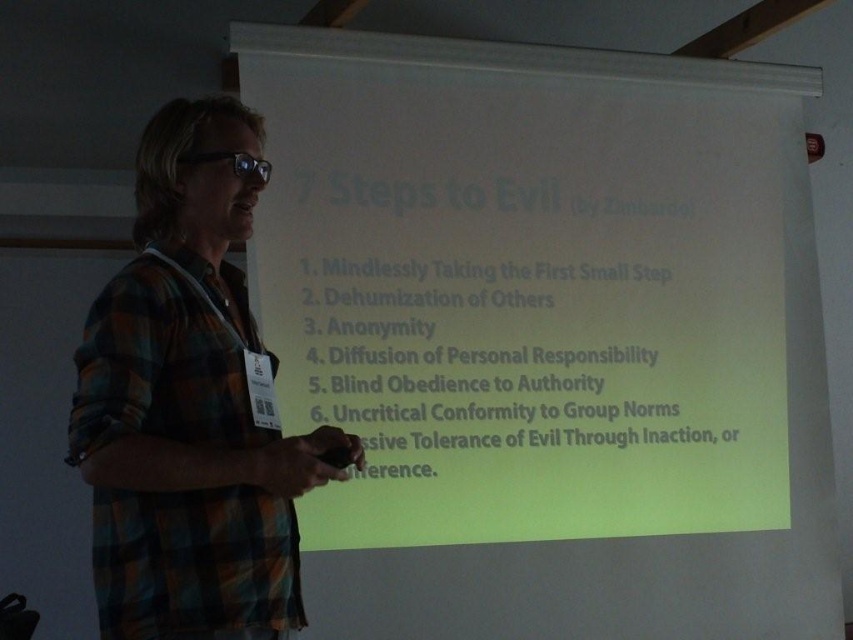
You are an event organizer setting up the presentation room. You need to ensure that the white matte projection screen at center is visible to all attendees. Considering the plaid fabric shirt at center is part of the presenter attire, which object should be placed higher to achieve this?

The white matte projection screen at center should be placed higher than the plaid fabric shirt at center to ensure visibility.

Looking at this image, you are an attendee at a conference and notice the white matte projection screen at center and the plaid fabric shirt at center. Which object is wider?

The white matte projection screen at center is wider than the plaid fabric shirt at center.